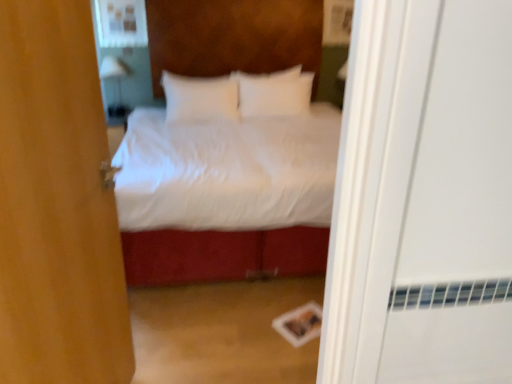
Question: Is white glossy lamp at upper left to the left or to the right of matte white medicine cabinet at upper left in the image?

Choices:
 (A) left
 (B) right

Answer: (A)

Question: Looking at their shapes, would you say white glossy lamp at upper left is wider or thinner than matte white medicine cabinet at upper left?

Choices:
 (A) wide
 (B) thin

Answer: (A)

Question: Which object is positioned closest to the white glossy lamp at upper left?

Choices:
 (A) matte white medicine cabinet at upper left
 (B) white soft pillow at center, acting as the second pillow starting from the right
 (C) brown fabric door at center
 (D) white soft bed at center
 (E) white soft pillow at center, the first pillow viewed from the right

Answer: (A)

Question: Considering the real-world distances, which object is farthest from the white soft pillow at center, the first pillow viewed from the right?

Choices:
 (A) white soft pillow at center, the first pillow when ordered from left to right
 (B) white soft bed at center
 (C) white glossy lamp at upper left
 (D) brown fabric door at center
 (E) matte white medicine cabinet at upper left

Answer: (D)